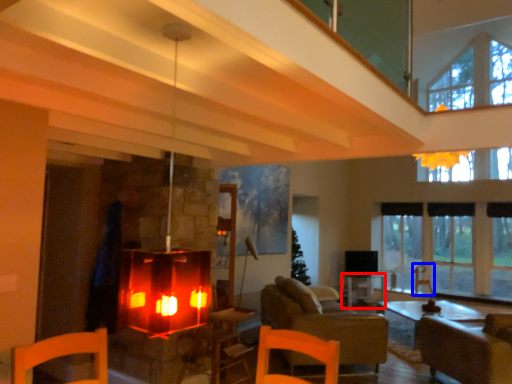
Question: Which point is closer to the camera, table (highlighted by a red box) or armchair (highlighted by a blue box)?

Choices:
 (A) table
 (B) armchair

Answer: (A)